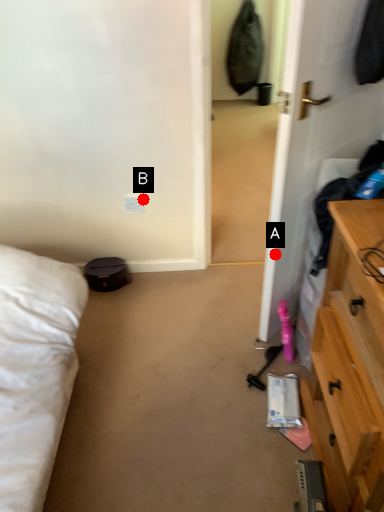
Question: Two points are circled on the image, labeled by A and B beside each circle. Which point is further to the camera?

Choices:
 (A) A is further
 (B) B is further

Answer: (B)